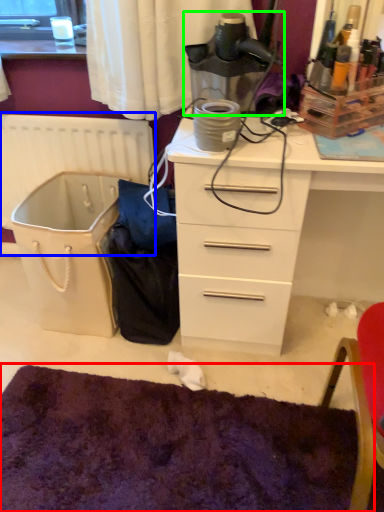
Question: Considering the real-world distances, which object is closest to mat (highlighted by a red box)? radiator (highlighted by a blue box) or appliance (highlighted by a green box).

Choices:
 (A) radiator
 (B) appliance

Answer: (A)